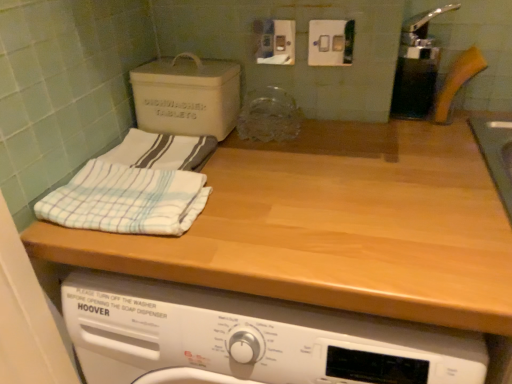
Question: Is white striped cloth at left, which is the first bath towel from front to back, inside or outside of matte gray cardboard box at upper left?

Choices:
 (A) inside
 (B) outside

Answer: (B)

Question: Looking at the image, does white striped cloth at left, the second bath towel from the back, seem bigger or smaller compared to matte gray cardboard box at upper left?

Choices:
 (A) big
 (B) small

Answer: (B)

Question: Which of these objects is positioned farthest from the white striped cloth at left, which is the first bath towel from front to back?

Choices:
 (A) wooden at upper center
 (B) matte gray cardboard box at upper left
 (C) white striped cloth at upper left, the second bath towel when ordered from front to back

Answer: (B)

Question: Which object is the closest to the matte gray cardboard box at upper left?

Choices:
 (A) white striped cloth at upper left, the second bath towel when ordered from front to back
 (B) white striped cloth at left, the second bath towel from the back
 (C) wooden at upper center

Answer: (A)